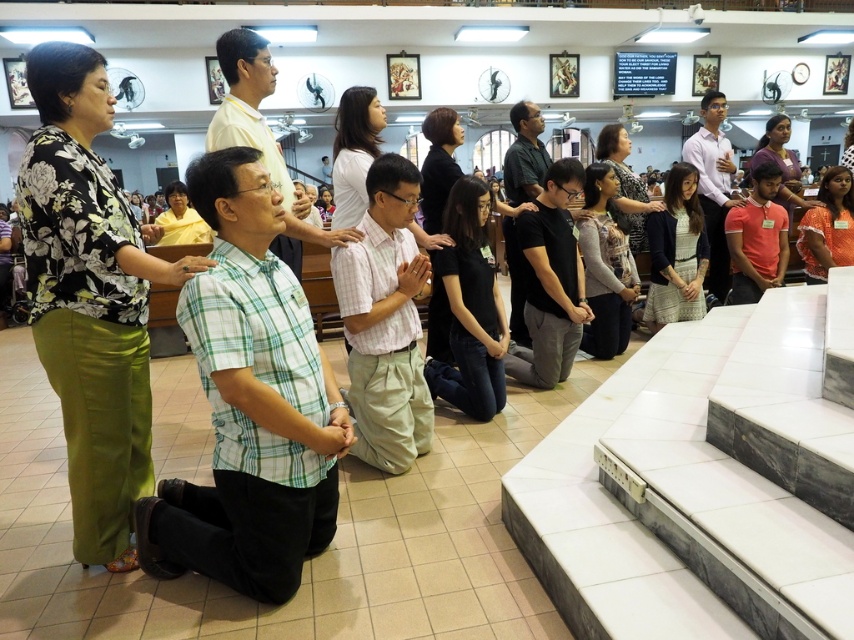
Question: Considering the real-world distances, which object is closest to the black matte shirt at center?

Choices:
 (A) dark green shirt at center
 (B) light pink plaid shirt at center

Answer: (A)

Question: Which of the following is the farthest from the observer?

Choices:
 (A) (533, 166)
 (B) (238, 320)
 (C) (541, 324)
 (D) (348, 291)

Answer: (A)

Question: Is black matte shirt at center wider than white shirt at center?

Choices:
 (A) yes
 (B) no

Answer: (B)

Question: Can you confirm if light pink plaid shirt at center is positioned above black matte shirt at center?

Choices:
 (A) yes
 (B) no

Answer: (B)

Question: Is green plaid shirt at center to the left of light pink plaid shirt at center from the viewer's perspective?

Choices:
 (A) yes
 (B) no

Answer: (A)

Question: Which object is positioned closest to the white shirt at center?

Choices:
 (A) dark green shirt at center
 (B) light pink plaid shirt at center
 (C) green plaid shirt at center
 (D) black matte shirt at center

Answer: (A)